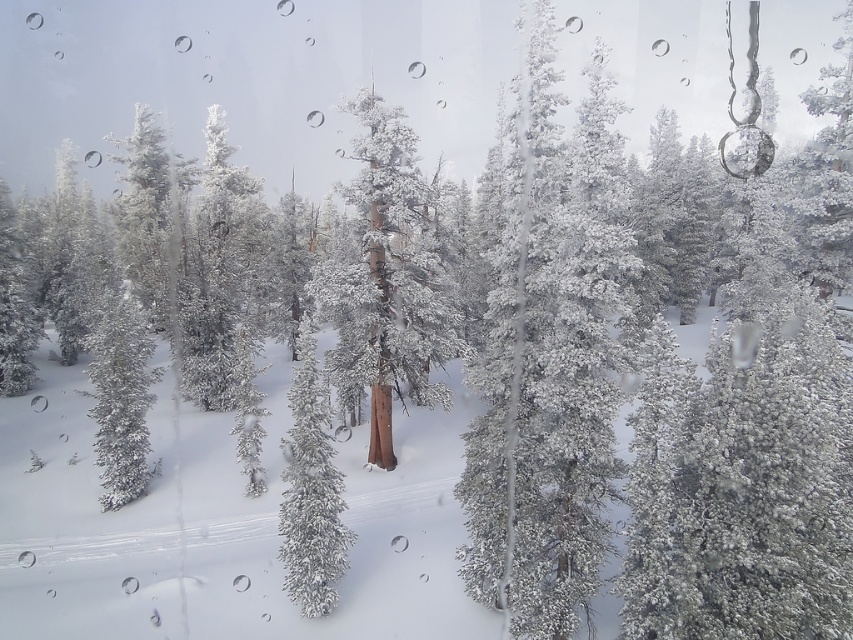
Question: Does snow-covered pine at center appear on the right side of snow-covered tree at center?

Choices:
 (A) yes
 (B) no

Answer: (A)

Question: Which point is farther to the camera?

Choices:
 (A) snow-covered tree at center
 (B) snow-covered pine at center

Answer: (A)

Question: Does snow-covered bark tree at center appear over snow-covered tree at center?

Choices:
 (A) no
 (B) yes

Answer: (B)

Question: Among these points, which one is farthest from the camera?

Choices:
 (A) (468, 556)
 (B) (326, 273)
 (C) (329, 484)

Answer: (B)

Question: Which object is closer to the camera taking this photo?

Choices:
 (A) snow-covered tree at center
 (B) snow-covered bark tree at center

Answer: (A)

Question: Does snow-covered pine at center have a greater width compared to snow-covered bark tree at center?

Choices:
 (A) no
 (B) yes

Answer: (B)